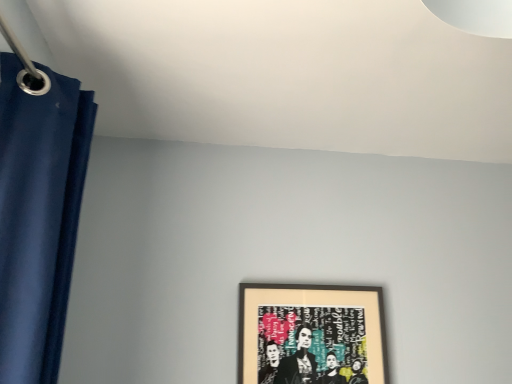
Question: From a real-world perspective, is matte blue curtain at left positioned under wooden framed artwork at center based on gravity?

Choices:
 (A) yes
 (B) no

Answer: (B)

Question: Can you confirm if matte blue curtain at left is thinner than wooden framed artwork at center?

Choices:
 (A) no
 (B) yes

Answer: (A)

Question: Is matte blue curtain at left further to camera compared to wooden framed artwork at center?

Choices:
 (A) yes
 (B) no

Answer: (B)

Question: Is matte blue curtain at left wider than wooden framed artwork at center?

Choices:
 (A) yes
 (B) no

Answer: (A)

Question: Can wooden framed artwork at center be found inside matte blue curtain at left?

Choices:
 (A) no
 (B) yes

Answer: (A)

Question: Can you confirm if matte blue curtain at left is taller than wooden framed artwork at center?

Choices:
 (A) yes
 (B) no

Answer: (A)

Question: Does wooden framed artwork at center lie behind matte blue curtain at left?

Choices:
 (A) no
 (B) yes

Answer: (B)

Question: Would you consider wooden framed artwork at center to be distant from matte blue curtain at left?

Choices:
 (A) yes
 (B) no

Answer: (B)

Question: Could you tell me if wooden framed artwork at center is facing matte blue curtain at left?

Choices:
 (A) no
 (B) yes

Answer: (A)

Question: Does wooden framed artwork at center have a lesser height compared to matte blue curtain at left?

Choices:
 (A) yes
 (B) no

Answer: (A)

Question: Considering the relative sizes of wooden framed artwork at center and matte blue curtain at left in the image provided, is wooden framed artwork at center smaller than matte blue curtain at left?

Choices:
 (A) yes
 (B) no

Answer: (A)

Question: Is wooden framed artwork at center directly adjacent to matte blue curtain at left?

Choices:
 (A) no
 (B) yes

Answer: (A)

Question: From a real-world perspective, is matte blue curtain at left above or below wooden framed artwork at center?

Choices:
 (A) below
 (B) above

Answer: (B)